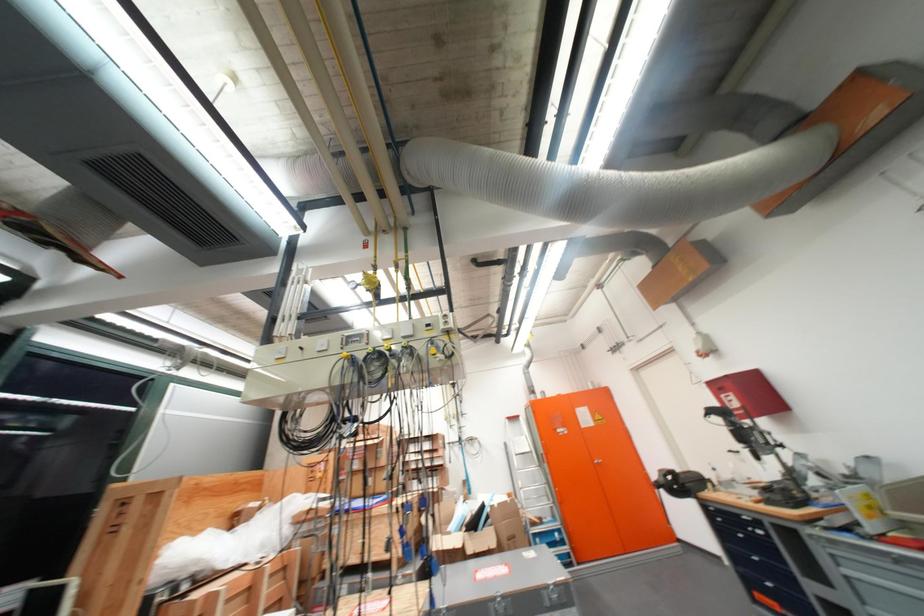
Locate an element on the screen. white door handle is located at coordinates (597, 476).